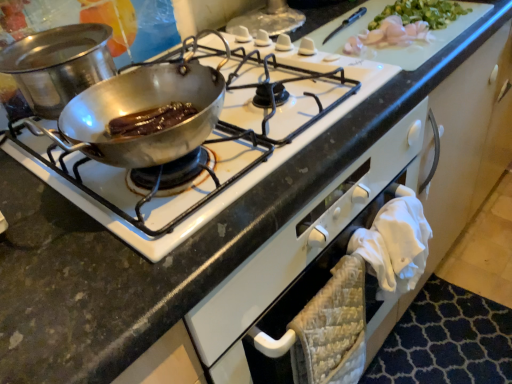
Question: Is shiny silver pan at upper left not near shiny metal pan at upper left?

Choices:
 (A) yes
 (B) no

Answer: (B)

Question: From the image's perspective, is shiny silver pan at upper left located above shiny metal pan at upper left?

Choices:
 (A) yes
 (B) no

Answer: (A)

Question: Can you confirm if shiny silver pan at upper left is smaller than shiny metal pan at upper left?

Choices:
 (A) yes
 (B) no

Answer: (A)

Question: From the image's perspective, is shiny silver pan at upper left beneath shiny metal pan at upper left?

Choices:
 (A) no
 (B) yes

Answer: (A)

Question: Is shiny silver pan at upper left surrounding shiny metal pan at upper left?

Choices:
 (A) yes
 (B) no

Answer: (B)

Question: Is shiny silver pan at upper left to the right of shiny metal pan at upper left from the viewer's perspective?

Choices:
 (A) yes
 (B) no

Answer: (B)

Question: Does shiny metal pan at upper left have a larger size compared to shiny silver pan at upper left?

Choices:
 (A) no
 (B) yes

Answer: (B)

Question: From a real-world perspective, is shiny metal pan at upper left physically below shiny silver pan at upper left?

Choices:
 (A) yes
 (B) no

Answer: (A)

Question: Is shiny metal pan at upper left positioned with its back to shiny silver pan at upper left?

Choices:
 (A) no
 (B) yes

Answer: (A)

Question: Considering the relative sizes of shiny metal pan at upper left and shiny silver pan at upper left in the image provided, is shiny metal pan at upper left wider than shiny silver pan at upper left?

Choices:
 (A) no
 (B) yes

Answer: (B)

Question: Is shiny metal pan at upper left completely or partially outside of shiny silver pan at upper left?

Choices:
 (A) yes
 (B) no

Answer: (A)

Question: Considering the relative sizes of shiny metal pan at upper left and shiny silver pan at upper left in the image provided, is shiny metal pan at upper left taller than shiny silver pan at upper left?

Choices:
 (A) no
 (B) yes

Answer: (A)

Question: Is shiny silver pan at upper left situated inside shiny metal pan at upper left or outside?

Choices:
 (A) inside
 (B) outside

Answer: (B)